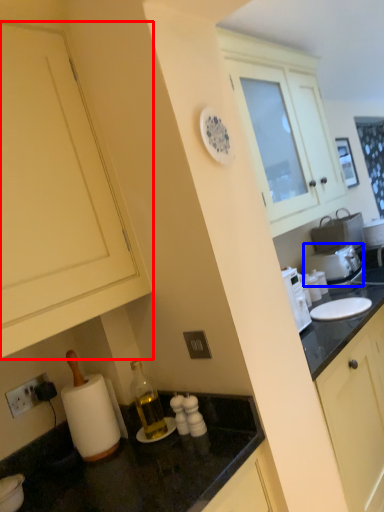
Question: Which point is further to the camera, cabinetry (highlighted by a red box) or appliance (highlighted by a blue box)?

Choices:
 (A) cabinetry
 (B) appliance

Answer: (B)